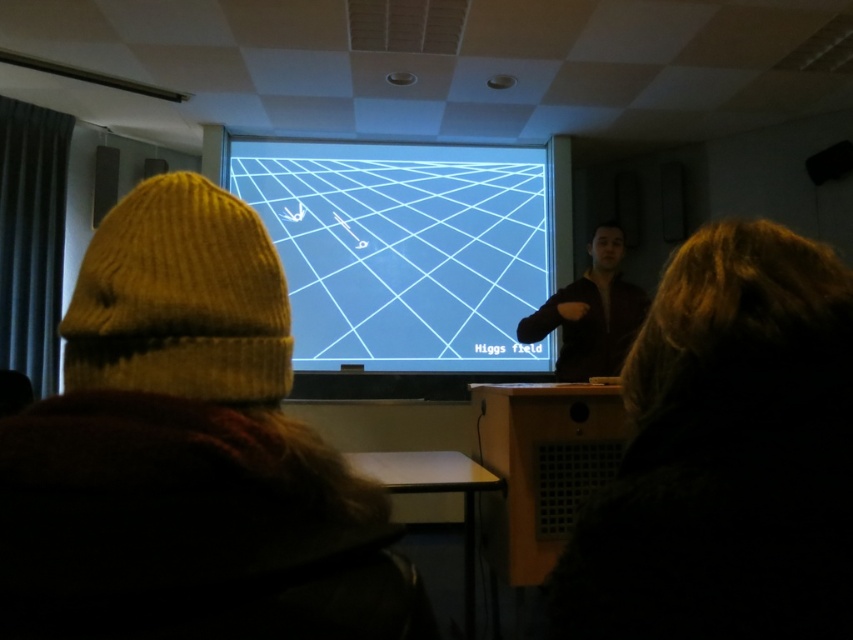
Based on the photo, between white grid at center and dark brown leather jacket at center, which one has more height?

With more height is white grid at center.

Which is in front, point (300, 193) or point (595, 333)?

Point (595, 333) is more forward.

I want to click on white grid at center, so (405, 250).

Who is more distant from viewer, (x=711, y=572) or (x=577, y=326)?

Point (x=577, y=326)

Who is positioned more to the right, dark brown fur coat at right or dark brown leather jacket at center?

From the viewer's perspective, dark brown leather jacket at center appears more on the right side.

This screenshot has height=640, width=853. I want to click on dark brown fur coat at right, so click(727, 454).

Which of these two, dark brown fur coat at right or white grid at center, stands taller?

Standing taller between the two is white grid at center.

Can you confirm if dark brown fur coat at right is taller than white grid at center?

No, dark brown fur coat at right is not taller than white grid at center.

The width and height of the screenshot is (853, 640). I want to click on dark brown fur coat at right, so click(x=727, y=454).